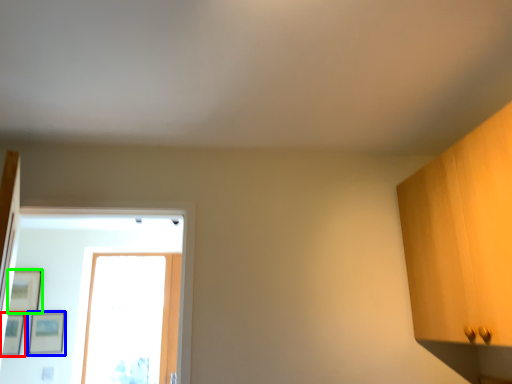
Question: Considering the real-world distances, which object is farthest from picture frame (highlighted by a red box)? picture frame (highlighted by a blue box) or picture frame (highlighted by a green box)?

Choices:
 (A) picture frame
 (B) picture frame

Answer: (B)